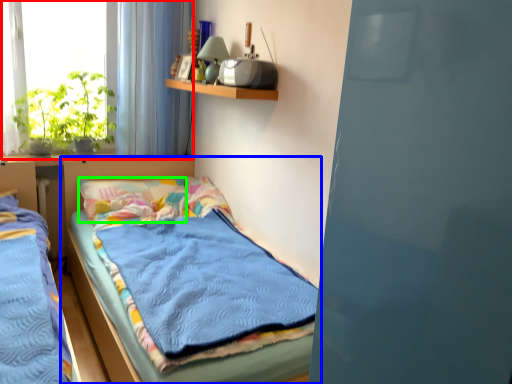
Question: Which object is positioned closest to window (highlighted by a red box)? Select from bed (highlighted by a blue box) and pillow (highlighted by a green box).

Choices:
 (A) bed
 (B) pillow

Answer: (B)